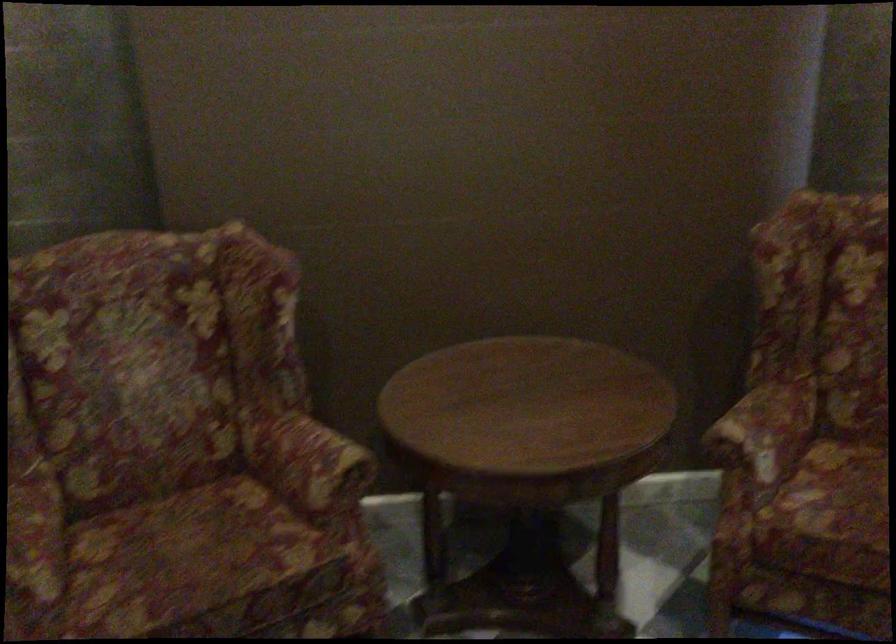
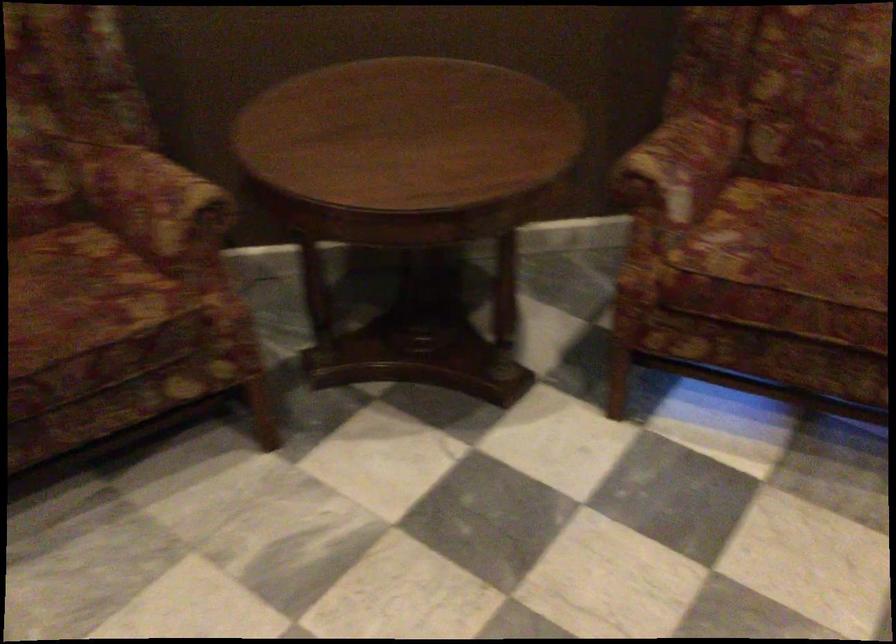
Question: How did the camera likely rotate?

Choices:
 (A) Left
 (B) Right
 (C) Up
 (D) Down

Answer: (D)